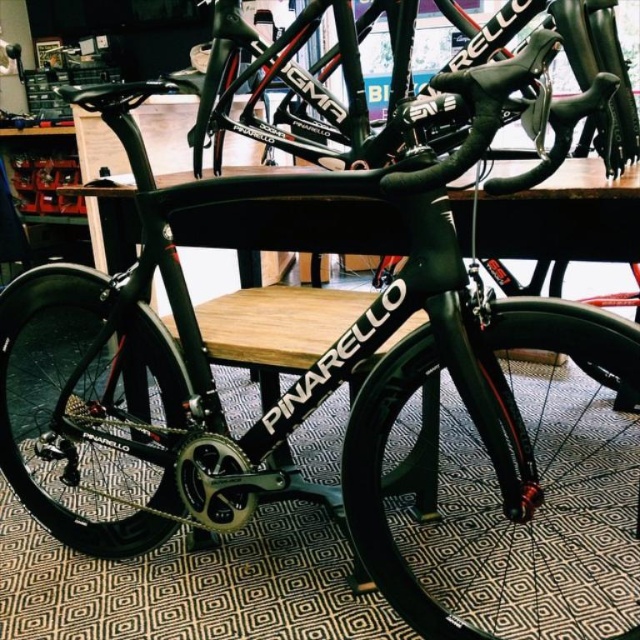
Does matte black wheel at center have a lesser height compared to black carbon fiber wheel at center?

No, matte black wheel at center is not shorter than black carbon fiber wheel at center.

Between matte black wheel at center and black carbon fiber wheel at center, which one has less height?

Standing shorter between the two is black carbon fiber wheel at center.

Locate an element on the screen. This screenshot has width=640, height=640. matte black wheel at center is located at coordinates (88, 410).